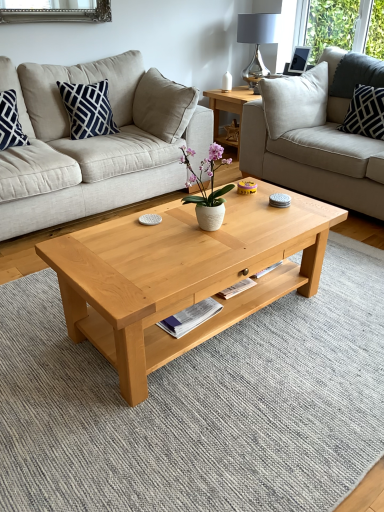
The image size is (384, 512). I want to click on natural wood coffee table at center, so click(181, 274).

The image size is (384, 512). Describe the element at coordinates (316, 135) in the screenshot. I see `light gray fabric couch at upper right, marked as the second studio couch in a left-to-right arrangement` at that location.

What is the approximate height of light gray fabric couch at upper right, marked as the second studio couch in a left-to-right arrangement?

light gray fabric couch at upper right, marked as the second studio couch in a left-to-right arrangement, is 38.28 inches in height.

This screenshot has width=384, height=512. What do you see at coordinates (299, 60) in the screenshot?
I see `matte black picture frame at upper right` at bounding box center [299, 60].

What do you see at coordinates (95, 143) in the screenshot? I see `beige fabric couch at center, arranged as the 2th studio couch when viewed from the right` at bounding box center [95, 143].

What do you see at coordinates (88, 109) in the screenshot?
I see `navy blue cotton pillow at upper left, placed as the 2th pillow when sorted from right to left` at bounding box center [88, 109].

The image size is (384, 512). Describe the element at coordinates (257, 41) in the screenshot. I see `metallic silver lamp at upper right` at that location.

This screenshot has height=512, width=384. Identify the location of natural wood coffee table at center. (181, 274).

Is point (357, 148) closer to camera compared to point (214, 252)?

No.

Looking at the image, does light gray fabric couch at upper right, the 1th studio couch from the right, seem bigger or smaller compared to natural wood coffee table at center?

Considering their sizes, light gray fabric couch at upper right, the 1th studio couch from the right, takes up more space than natural wood coffee table at center.

Is light gray fabric couch at upper right, the 1th studio couch from the right, in front of natural wood coffee table at center?

No, the depth of light gray fabric couch at upper right, the 1th studio couch from the right, is greater than that of natural wood coffee table at center.

From the image's perspective, between light gray fabric couch at upper right, the 1th studio couch from the right, and natural wood coffee table at center, which one is located above?

light gray fabric couch at upper right, the 1th studio couch from the right, from the image's perspective.

Consider the image. Does white cotton pillow at upper right, the 1th pillow when ordered from right to left, have a lesser width compared to navy blue cotton pillow at upper left, placed as the 2th pillow when sorted from right to left?

Incorrect, the width of white cotton pillow at upper right, the 1th pillow when ordered from right to left, is not less than that of navy blue cotton pillow at upper left, placed as the 2th pillow when sorted from right to left.

Does white cotton pillow at upper right, the 1th pillow when ordered from right to left, lie behind navy blue cotton pillow at upper left, which is the first pillow in left-to-right order?

Yes, white cotton pillow at upper right, the 1th pillow when ordered from right to left, is further from the viewer.

From their relative heights in the image, would you say white cotton pillow at upper right, the 1th pillow when ordered from right to left, is taller or shorter than navy blue cotton pillow at upper left, placed as the 2th pillow when sorted from right to left?

white cotton pillow at upper right, the 1th pillow when ordered from right to left, is shorter than navy blue cotton pillow at upper left, placed as the 2th pillow when sorted from right to left.

From a real-world perspective, who is located lower, navy blue cotton pillow at upper left, placed as the 2th pillow when sorted from right to left, or beige fabric couch at center, arranged as the 2th studio couch when viewed from the right?

In real-world perspective, beige fabric couch at center, arranged as the 2th studio couch when viewed from the right, is lower.

Can you tell me how much navy blue cotton pillow at upper left, which is the first pillow in left-to-right order, and beige fabric couch at center, arranged as the 2th studio couch when viewed from the right, differ in facing direction?

The angular difference between navy blue cotton pillow at upper left, which is the first pillow in left-to-right order, and beige fabric couch at center, arranged as the 2th studio couch when viewed from the right, is 0.00118 degrees.

From the image's perspective, between navy blue cotton pillow at upper left, which is the first pillow in left-to-right order, and beige fabric couch at center, arranged as the 2th studio couch when viewed from the right, which one is located above?

navy blue cotton pillow at upper left, which is the first pillow in left-to-right order.

Is light gray fabric couch at upper right, the 1th studio couch from the right, beside beige fabric couch at center, the 1th studio couch positioned from the left?

→ No, light gray fabric couch at upper right, the 1th studio couch from the right, is not touching beige fabric couch at center, the 1th studio couch positioned from the left.

From the image's perspective, is light gray fabric couch at upper right, the 1th studio couch from the right, under beige fabric couch at center, arranged as the 2th studio couch when viewed from the right?

Incorrect, from the image's perspective, light gray fabric couch at upper right, the 1th studio couch from the right, is higher than beige fabric couch at center, arranged as the 2th studio couch when viewed from the right.

Considering the relative sizes of light gray fabric couch at upper right, the 1th studio couch from the right, and beige fabric couch at center, the 1th studio couch positioned from the left, in the image provided, is light gray fabric couch at upper right, the 1th studio couch from the right, thinner than beige fabric couch at center, the 1th studio couch positioned from the left,?

Yes, light gray fabric couch at upper right, the 1th studio couch from the right, is thinner than beige fabric couch at center, the 1th studio couch positioned from the left.

From a real-world perspective, which object stands above the other?

From a 3D spatial view, white cotton pillow at upper right, the 2th pillow when ordered from left to right, is above.

Can you confirm if beige fabric couch at center, arranged as the 2th studio couch when viewed from the right, is smaller than white cotton pillow at upper right, the 2th pillow when ordered from left to right?

Incorrect, beige fabric couch at center, arranged as the 2th studio couch when viewed from the right, is not smaller in size than white cotton pillow at upper right, the 2th pillow when ordered from left to right.

Is beige fabric couch at center, the 1th studio couch positioned from the left, outside of white cotton pillow at upper right, the 1th pillow when ordered from right to left?

That's correct, beige fabric couch at center, the 1th studio couch positioned from the left, is outside of white cotton pillow at upper right, the 1th pillow when ordered from right to left.

From the picture: What's the angular difference between beige fabric couch at center, the 1th studio couch positioned from the left, and white cotton pillow at upper right, the 2th pillow when ordered from left to right,'s facing directions?

There is a 89.6-degree angle between the facing directions of beige fabric couch at center, the 1th studio couch positioned from the left, and white cotton pillow at upper right, the 2th pillow when ordered from left to right.

Consider the image. Is matte black picture frame at upper right oriented away from natural wood coffee table at center?

matte black picture frame at upper right does not have its back to natural wood coffee table at center.

Would you say natural wood coffee table at center is part of matte black picture frame at upper right's contents?

No, natural wood coffee table at center is not a part of matte black picture frame at upper right.

Between matte black picture frame at upper right and natural wood coffee table at center, which one appears on the right side from the viewer's perspective?

matte black picture frame at upper right.

Between matte black picture frame at upper right and natural wood coffee table at center, which one has smaller size?

matte black picture frame at upper right.

Is white cotton pillow at upper right, the 1th pillow when ordered from right to left, looking in the opposite direction of metallic silver lamp at upper right?

No, white cotton pillow at upper right, the 1th pillow when ordered from right to left, is not facing the opposite direction of metallic silver lamp at upper right.

Considering the positions of point (354, 115) and point (259, 44), is point (354, 115) closer or farther from the camera than point (259, 44)?

Clearly, point (354, 115) is closer to the camera than point (259, 44).

Looking at this image, from a real-world perspective, is white cotton pillow at upper right, the 1th pillow when ordered from right to left, positioned under metallic silver lamp at upper right based on gravity?

Yes, from a real-world perspective, white cotton pillow at upper right, the 1th pillow when ordered from right to left, is under metallic silver lamp at upper right.

Locate an element on the screen. studio couch that is on the right side of natural wood coffee table at center is located at coordinates (316, 135).

Locate an element on the screen. pillow above the white cotton pillow at upper right, the 1th pillow when ordered from right to left (from a real-world perspective) is located at coordinates (88, 109).

Estimate the real-world distances between objects in this image. Which object is closer to white cotton pillow at upper right, the 1th pillow when ordered from right to left, light gray fabric couch at upper right, the 1th studio couch from the right, or beige fabric couch at center, arranged as the 2th studio couch when viewed from the right?

Based on the image, light gray fabric couch at upper right, the 1th studio couch from the right, appears to be nearer to white cotton pillow at upper right, the 1th pillow when ordered from right to left.

Estimate the real-world distances between objects in this image. Which object is further from navy blue cotton pillow at upper left, which is the first pillow in left-to-right order, light gray fabric couch at upper right, marked as the second studio couch in a left-to-right arrangement, or white ceramic vase at center?

Among the two, light gray fabric couch at upper right, marked as the second studio couch in a left-to-right arrangement, is located further to navy blue cotton pillow at upper left, which is the first pillow in left-to-right order.

Which object lies further to the anchor point white ceramic vase at center, metallic silver lamp at upper right or white cotton pillow at upper right, the 1th pillow when ordered from right to left?

Based on the image, metallic silver lamp at upper right appears to be further to white ceramic vase at center.

Looking at the image, which one is located closer to matte black picture frame at upper right, navy blue cotton pillow at upper left, which is the first pillow in left-to-right order, or natural wood coffee table at center?

Based on the image, navy blue cotton pillow at upper left, which is the first pillow in left-to-right order, appears to be nearer to matte black picture frame at upper right.

Considering their positions, is light gray fabric couch at upper right, the 1th studio couch from the right, positioned further to metallic silver lamp at upper right than natural wood coffee table at center?

natural wood coffee table at center.

Estimate the real-world distances between objects in this image. Which object is further from light gray fabric couch at upper right, marked as the second studio couch in a left-to-right arrangement, navy blue cotton pillow at upper left, which is the first pillow in left-to-right order, or white ceramic vase at center?

navy blue cotton pillow at upper left, which is the first pillow in left-to-right order.

From the image, which object appears to be farther from white ceramic vase at center, beige fabric couch at center, the 1th studio couch positioned from the left, or white cotton pillow at upper right, the 1th pillow when ordered from right to left?

white cotton pillow at upper right, the 1th pillow when ordered from right to left, is further to white ceramic vase at center.

When comparing their distances from white ceramic vase at center, does metallic silver lamp at upper right or natural wood coffee table at center seem further?

Among the two, metallic silver lamp at upper right is located further to white ceramic vase at center.

I want to click on coffee table between beige fabric couch at center, arranged as the 2th studio couch when viewed from the right, and light gray fabric couch at upper right, the 1th studio couch from the right, in the horizontal direction, so click(181, 274).

Locate an element on the screen. The height and width of the screenshot is (512, 384). studio couch between beige fabric couch at center, arranged as the 2th studio couch when viewed from the right, and white cotton pillow at upper right, the 1th pillow when ordered from right to left, in the horizontal direction is located at coordinates (316, 135).

Locate an element on the screen. Image resolution: width=384 pixels, height=512 pixels. pillow between beige fabric couch at center, arranged as the 2th studio couch when viewed from the right, and white cotton pillow at upper right, the 1th pillow when ordered from right to left, from left to right is located at coordinates (88, 109).

You are a GUI agent. You are given a task and a screenshot of the screen. Output one action in this format:
    pyautogui.click(x=<x>, y=<y>)
    Task: Click on the coffee table between beige fabric couch at center, arranged as the 2th studio couch when viewed from the right, and white cotton pillow at upper right, the 1th pillow when ordered from right to left
    The width and height of the screenshot is (384, 512).
    Given the screenshot: What is the action you would take?
    pyautogui.click(x=181, y=274)